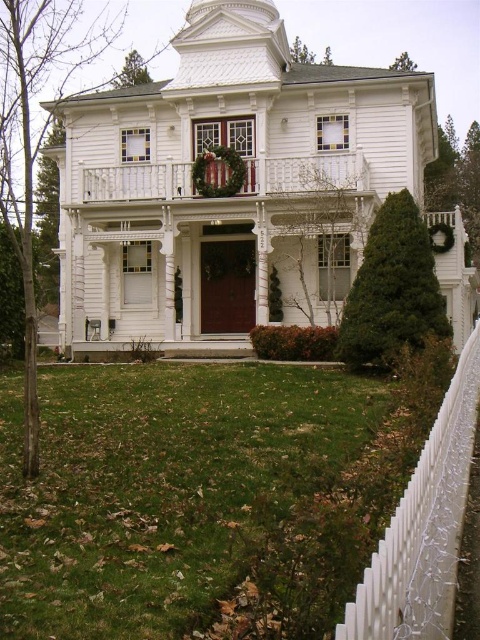
Is white picket fence at right to the left of white wooden porch at upper center from the viewer's perspective?

No, white picket fence at right is not to the left of white wooden porch at upper center.

Image resolution: width=480 pixels, height=640 pixels. Find the location of `white picket fence at right`. white picket fence at right is located at coordinates (423, 528).

Is green grass at lower left bigger than white wooden porch at upper center?

Yes.

Does green grass at lower left have a lesser height compared to white wooden porch at upper center?

Indeed, green grass at lower left has a lesser height compared to white wooden porch at upper center.

Where is `green grass at lower left`? green grass at lower left is located at coordinates (156, 486).

Is green grass at lower left further to the viewer compared to white picket fence at right?

Yes, it is.

How much distance is there between green grass at lower left and white picket fence at right?

green grass at lower left is 6.15 meters from white picket fence at right.

Find the location of `green grass at lower left`. green grass at lower left is located at coordinates point(156,486).